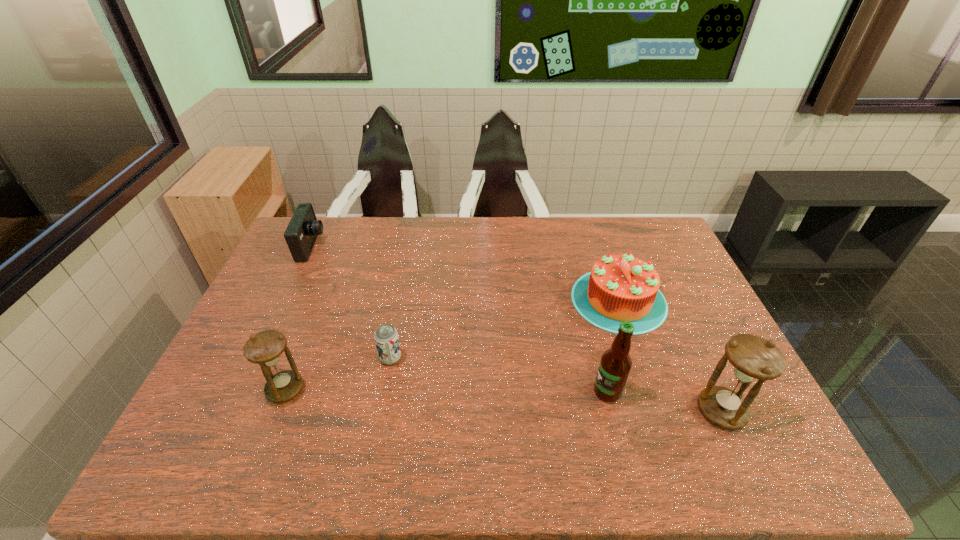
I want to click on object that is the second closest one to the third object from left to right, so [301, 233].

Select which object appears as the fourth closest to the beer bottle. Please provide its 2D coordinates. Your answer should be formatted as a tuple, i.e. [(x, y)], where the tuple contains the x and y coordinates of a point satisfying the conditions above.

[(265, 348)]

Find the location of `free space in the image that satisfies the following two spatial constraints: 1. on the back side of the beer can; 2. on the front-facing side of the leftmost object`. free space in the image that satisfies the following two spatial constraints: 1. on the back side of the beer can; 2. on the front-facing side of the leftmost object is located at coordinates (412, 247).

The height and width of the screenshot is (540, 960). I want to click on vacant space that satisfies the following two spatial constraints: 1. on the back side of the taller hourglass; 2. on the front-facing side of the farthest object, so click(x=645, y=247).

Where is `free space that satisfies the following two spatial constraints: 1. on the back side of the cake; 2. on the front-facing side of the leftmost object`? free space that satisfies the following two spatial constraints: 1. on the back side of the cake; 2. on the front-facing side of the leftmost object is located at coordinates [x=601, y=247].

Locate an element on the screen. The height and width of the screenshot is (540, 960). free location that satisfies the following two spatial constraints: 1. on the front-facing side of the fifth nearest object; 2. on the right side of the farthest object is located at coordinates (286, 300).

Where is `free space that satisfies the following two spatial constraints: 1. on the front side of the second object from left to right; 2. on the right side of the taller hourglass`? free space that satisfies the following two spatial constraints: 1. on the front side of the second object from left to right; 2. on the right side of the taller hourglass is located at coordinates (276, 411).

At what (x,y) coordinates should I click in order to perform the action: click on free location that satisfies the following two spatial constraints: 1. on the front-facing side of the camera; 2. on the right side of the taller hourglass. Please return your answer as a coordinate pair (x, y). This screenshot has width=960, height=540. Looking at the image, I should click on (234, 411).